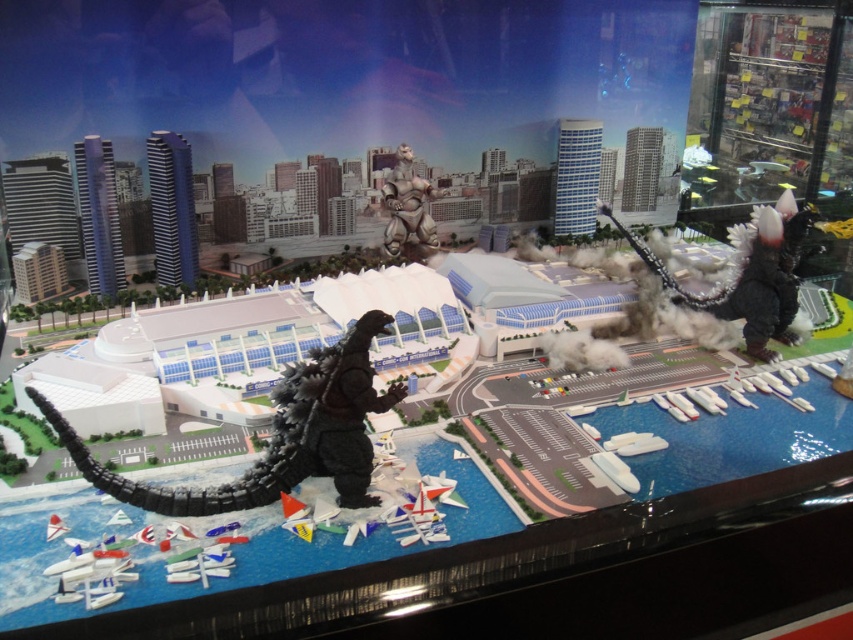
Looking at this image, does black matte toy at center have a lesser height compared to satin black godzilla at right?

Correct, black matte toy at center is not as tall as satin black godzilla at right.

Is black matte toy at center behind satin black godzilla at right?

That is False.

Does point (306, 392) come behind point (732, 301)?

No, it is in front of (732, 301).

Locate an element on the screen. black matte toy at center is located at coordinates (277, 435).

Is black matte toy at center bigger than metallic silver robot at center?

Indeed, black matte toy at center has a larger size compared to metallic silver robot at center.

You are a GUI agent. You are given a task and a screenshot of the screen. Output one action in this format:
    pyautogui.click(x=<x>, y=<y>)
    Task: Click on the black matte toy at center
    
    Given the screenshot: What is the action you would take?
    pyautogui.click(x=277, y=435)

Is satin black godzilla at right smaller than metallic silver robot at center?

No.

Is satin black godzilla at right taller than metallic silver robot at center?

Correct, satin black godzilla at right is much taller as metallic silver robot at center.

Is point (775, 314) closer to viewer compared to point (421, 230)?

Yes, it is.

At what (x,y) coordinates should I click in order to perform the action: click on satin black godzilla at right. Please return your answer as a coordinate pair (x, y). Image resolution: width=853 pixels, height=640 pixels. Looking at the image, I should click on (750, 275).